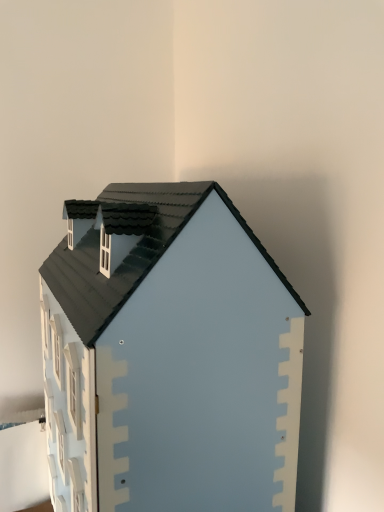
Question: Should I look upward or downward to see matte blue wooden house at center?

Choices:
 (A) up
 (B) down

Answer: (B)